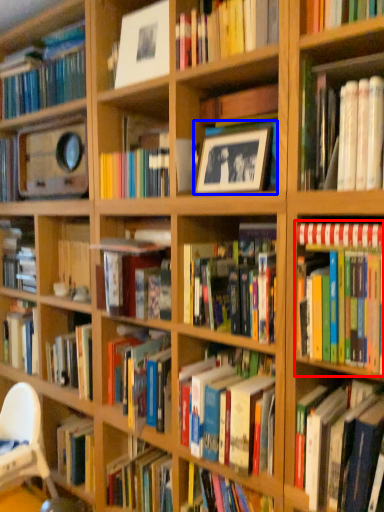
Question: Which object is further to the camera taking this photo, book (highlighted by a red box) or picture frame (highlighted by a blue box)?

Choices:
 (A) book
 (B) picture frame

Answer: (B)